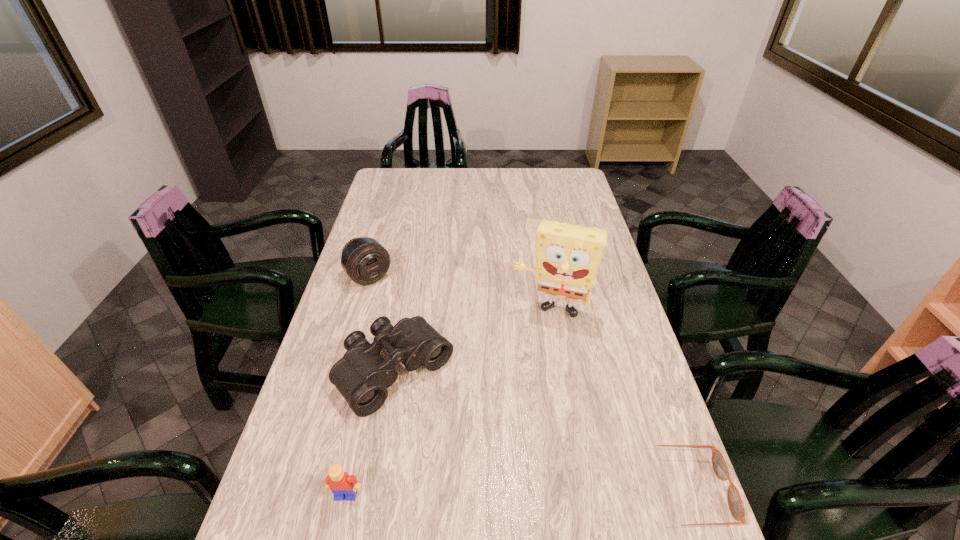
Image resolution: width=960 pixels, height=540 pixels. In order to click on Lego in this screenshot , I will do `click(341, 484)`.

At what (x,y) coordinates should I click in order to perform the action: click on sunglasses. Please return your answer as a coordinate pair (x, y). This screenshot has width=960, height=540. Looking at the image, I should click on (736, 507).

Identify the location of the shortest object. (736, 507).

Where is `the third nearest object`? This screenshot has width=960, height=540. the third nearest object is located at coordinates (362, 376).

Locate an element on the screen. This screenshot has width=960, height=540. the second object from right to left is located at coordinates (568, 256).

You are a GUI agent. You are given a task and a screenshot of the screen. Output one action in this format:
    pyautogui.click(x=<x>, y=<y>)
    Task: Click on the sponge
    This screenshot has height=540, width=960.
    Given the screenshot: What is the action you would take?
    pyautogui.click(x=568, y=256)

At what (x,y) coordinates should I click in order to perform the action: click on the farthest object. Please return your answer as a coordinate pair (x, y). The image size is (960, 540). Looking at the image, I should click on (365, 260).

The height and width of the screenshot is (540, 960). Find the location of `the fourth shortest object`. the fourth shortest object is located at coordinates (365, 260).

Identify the location of free spot located on the face of the Lego. This screenshot has height=540, width=960. [x=339, y=528].

At what (x,y) coordinates should I click in order to perform the action: click on vacant area situated 0.070m at the eyepieces of the third nearest object. Please return your answer as a coordinate pair (x, y). The width and height of the screenshot is (960, 540). Looking at the image, I should click on (447, 429).